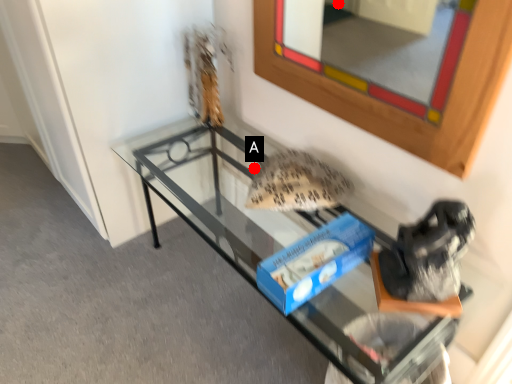
Question: Two points are circled on the image, labeled by A and B beside each circle. Which point is farther to the camera?

Choices:
 (A) A is further
 (B) B is further

Answer: (B)